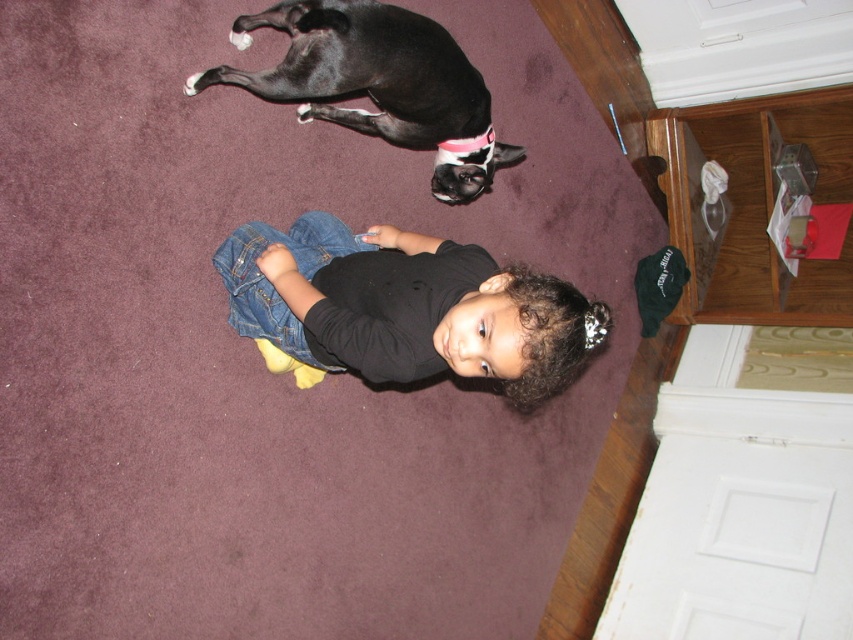
Question: Which object appears closest to the camera in this image?

Choices:
 (A) black matte dog at upper center
 (B) denim jeans at center

Answer: (B)

Question: Among these objects, which one is nearest to the camera?

Choices:
 (A) black matte dog at upper center
 (B) denim jeans at center

Answer: (B)

Question: Does denim jeans at center have a larger size compared to black matte dog at upper center?

Choices:
 (A) yes
 (B) no

Answer: (A)

Question: Is denim jeans at center below black matte dog at upper center?

Choices:
 (A) no
 (B) yes

Answer: (B)

Question: From the image, what is the correct spatial relationship of denim jeans at center in relation to black matte dog at upper center?

Choices:
 (A) right
 (B) left

Answer: (A)

Question: Which point is closer to the camera?

Choices:
 (A) (334, 237)
 (B) (196, 80)

Answer: (B)